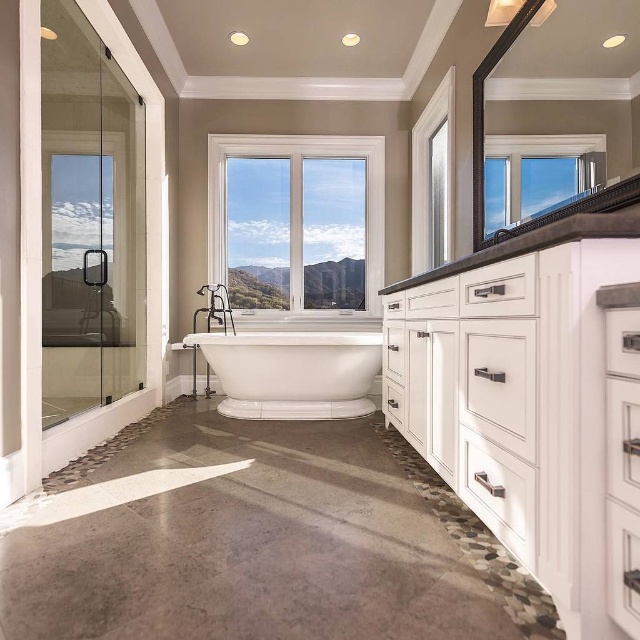
Question: Can you confirm if white matte cabinet at right is bigger than white glossy sink at center?

Choices:
 (A) no
 (B) yes

Answer: (B)

Question: Is white matte cabinet at right to the right of white glossy bathtub at center from the viewer's perspective?

Choices:
 (A) yes
 (B) no

Answer: (A)

Question: Which point is closer to the camera taking this photo?

Choices:
 (A) pyautogui.click(x=531, y=216)
 (B) pyautogui.click(x=364, y=333)
 (C) pyautogui.click(x=188, y=349)

Answer: (A)

Question: Which of the following is the closest to the observer?

Choices:
 (A) [218, 268]
 (B) [540, 205]
 (C) [545, 310]
 (D) [241, 397]

Answer: (C)

Question: Can you confirm if white matte cabinet at right is positioned to the right of clear glass window at center?

Choices:
 (A) no
 (B) yes

Answer: (B)

Question: Which of the following is the farthest from the observer?

Choices:
 (A) clear glass window at upper center
 (B) white matte cabinet at right

Answer: (A)